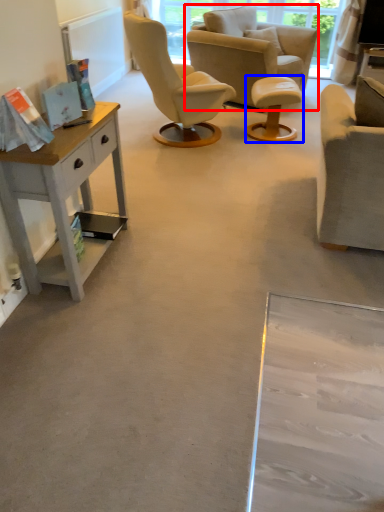
Question: Which point is closer to the camera, chair (highlighted by a red box) or stool (highlighted by a blue box)?

Choices:
 (A) chair
 (B) stool

Answer: (B)